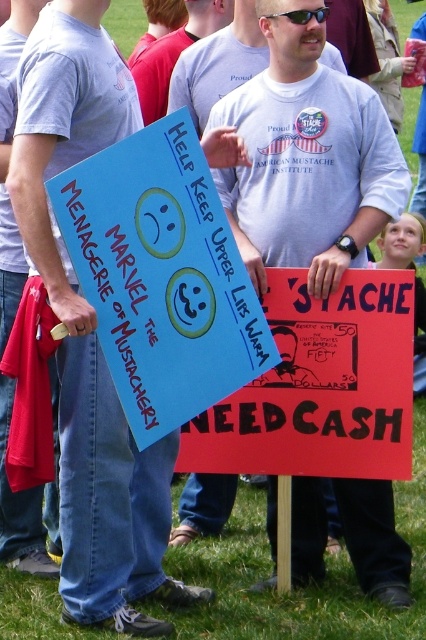
Does blue cardboard sign at center have a lesser height compared to red cardboard sign at center?

In fact, blue cardboard sign at center may be taller than red cardboard sign at center.

The image size is (426, 640). I want to click on blue cardboard sign at center, so click(x=161, y=276).

Is point (169, 209) farther from viewer compared to point (293, 269)?

No, it is not.

The image size is (426, 640). I want to click on blue cardboard sign at center, so click(x=161, y=276).

Which is above, red cardboard sign at center or sunglasses at center?

sunglasses at center is higher up.

Who is more forward, (342, 435) or (307, 19)?

Point (307, 19) is in front.

At what (x,y) coordinates should I click in order to perform the action: click on red cardboard sign at center. Please return your answer as a coordinate pair (x, y). Looking at the image, I should click on (319, 387).

Can you confirm if blue cardboard sign at center is wider than matte gray t-shirt at left?

Yes, blue cardboard sign at center is wider than matte gray t-shirt at left.

This screenshot has width=426, height=640. Describe the element at coordinates (161, 276) in the screenshot. I see `blue cardboard sign at center` at that location.

I want to click on blue cardboard sign at center, so click(161, 276).